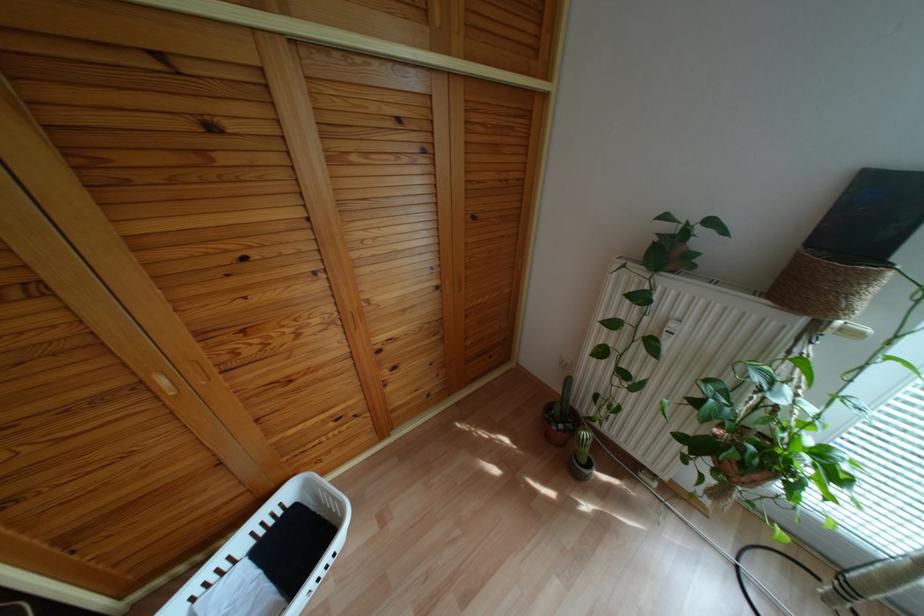
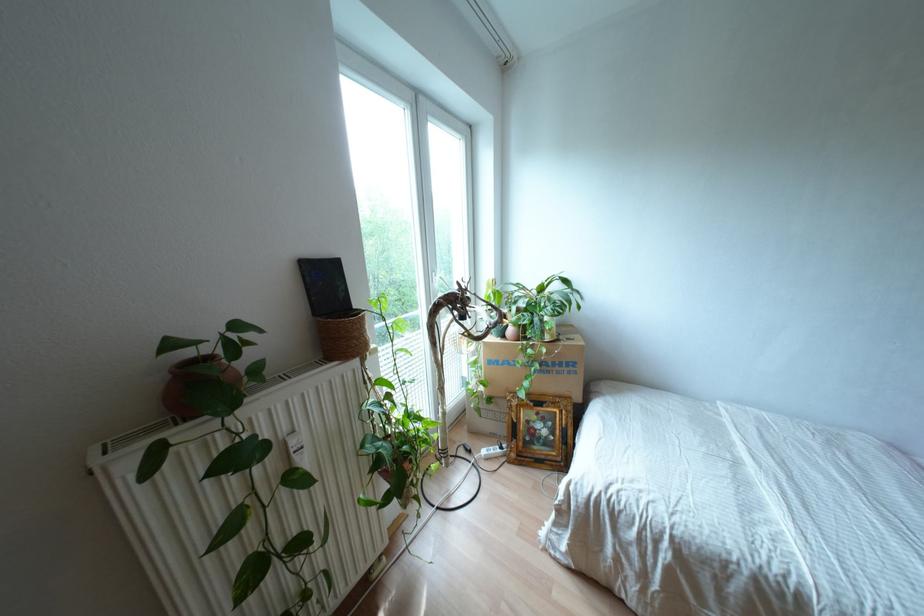
The first image is from the beginning of the video and the second image is from the end. How did the camera likely rotate when shooting the video?

The rotation direction of the camera is right-down.